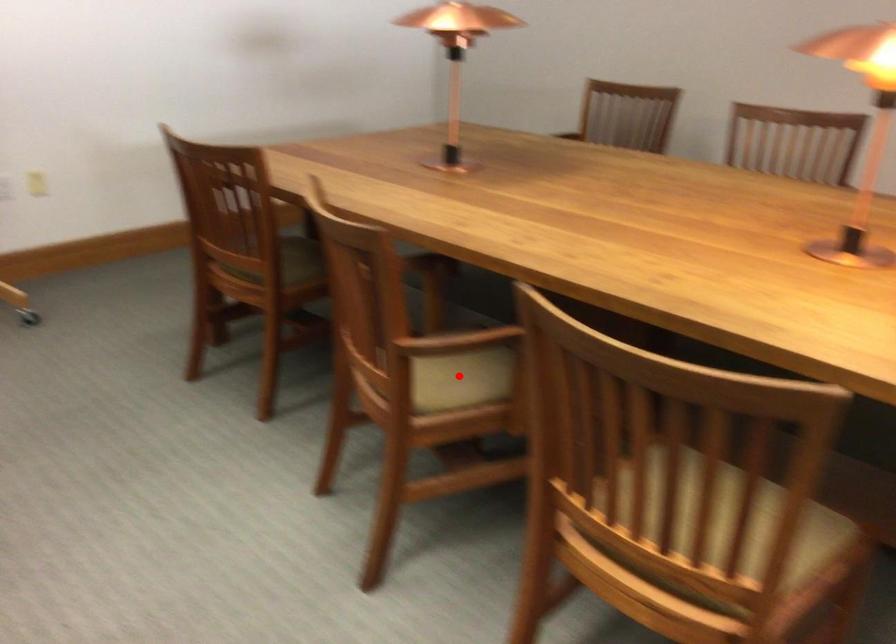
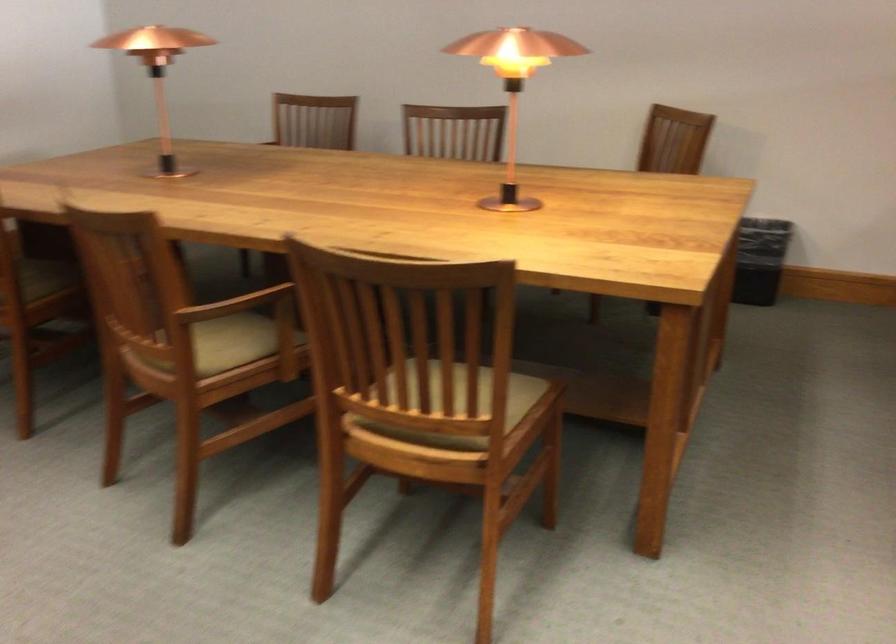
Locate, in the second image, the point that corresponds to the highlighted location in the first image.

(228, 343)